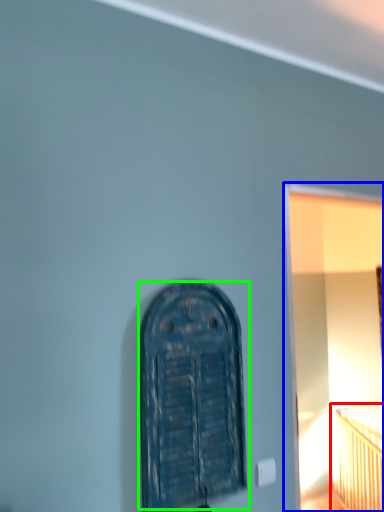
Question: Estimate the real-world distances between objects in this image. Which object is farther from bed (highlighted by a red box), window frame (highlighted by a blue box) or door (highlighted by a green box)?

Choices:
 (A) window frame
 (B) door

Answer: (B)